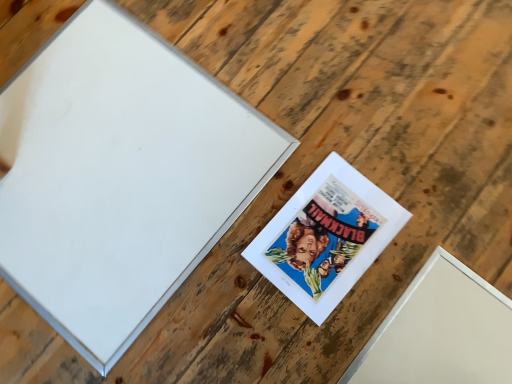
At what (x,y) coordinates should I click in order to perform the action: click on vacant area in front of matte paper picture frame at center, arranged as the first picture frame when viewed from the right. Please return your answer as a coordinate pair (x, y). Image resolution: width=512 pixels, height=384 pixels. Looking at the image, I should click on (360, 337).